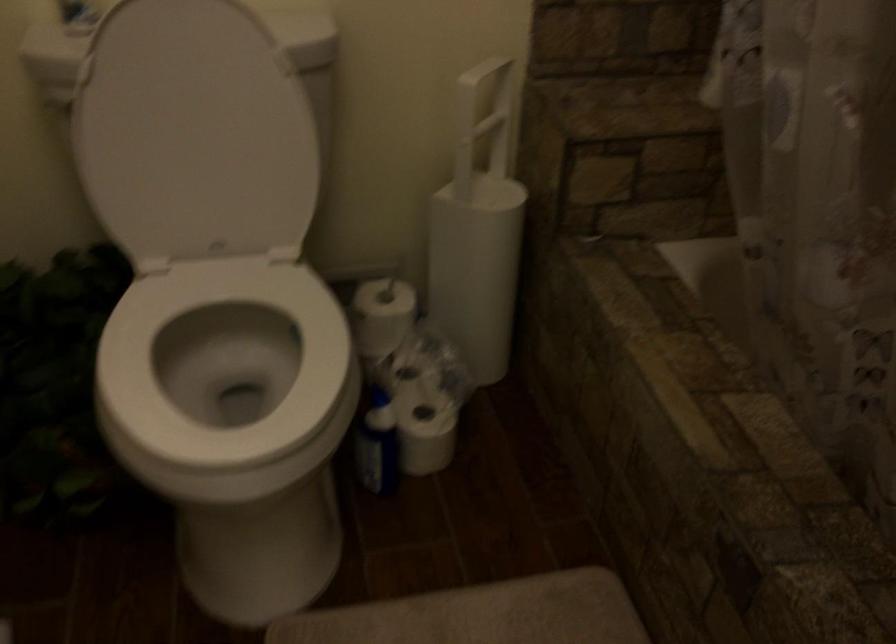
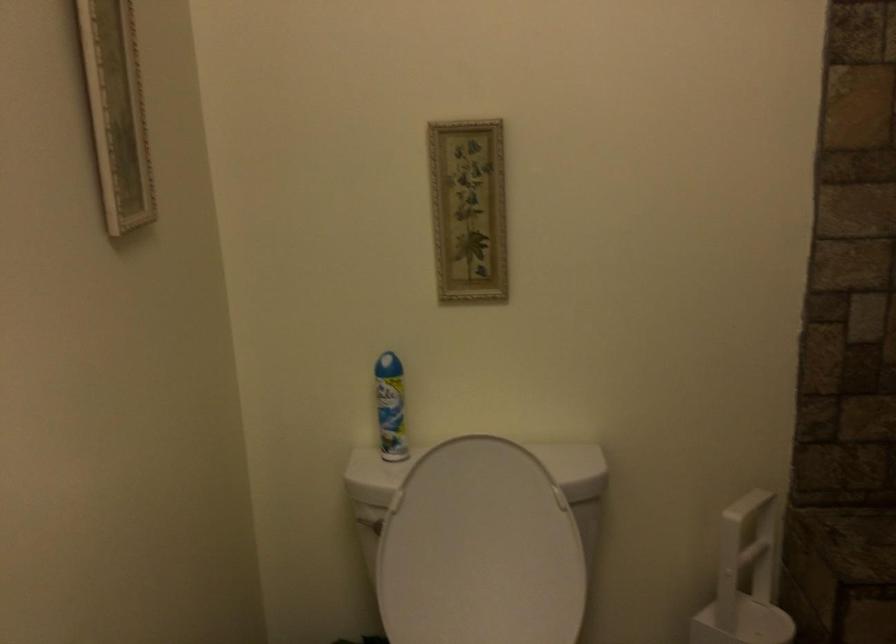
Question: The images are taken continuously from a first-person perspective. In which direction are you moving?

Choices:
 (A) Left
 (B) Right
 (C) Forward
 (D) Backward

Answer: (D)